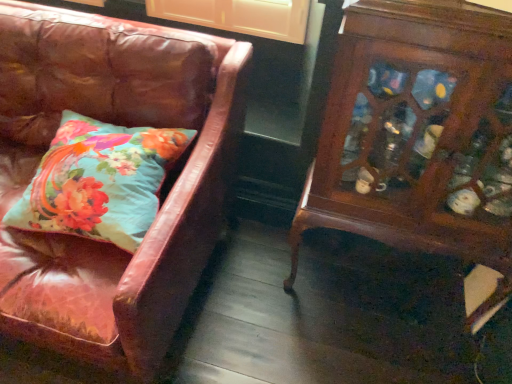
Question: From the image's perspective, does wooden cabinet at right appear lower than leather couch at left?

Choices:
 (A) yes
 (B) no

Answer: (A)

Question: Does wooden cabinet at right have a greater height compared to leather couch at left?

Choices:
 (A) no
 (B) yes

Answer: (B)

Question: Is wooden cabinet at right positioned beyond the bounds of leather couch at left?

Choices:
 (A) no
 (B) yes

Answer: (B)

Question: Is wooden cabinet at right smaller than leather couch at left?

Choices:
 (A) no
 (B) yes

Answer: (B)

Question: Would you say wooden cabinet at right contains leather couch at left?

Choices:
 (A) yes
 (B) no

Answer: (B)

Question: From the image's perspective, is wooden cabinet at right positioned above or below leather couch at left?

Choices:
 (A) below
 (B) above

Answer: (A)

Question: Looking at the image, does wooden cabinet at right seem bigger or smaller compared to leather couch at left?

Choices:
 (A) small
 (B) big

Answer: (A)

Question: Considering their positions, is wooden cabinet at right located in front of or behind leather couch at left?

Choices:
 (A) front
 (B) behind

Answer: (B)

Question: From a real-world perspective, relative to leather couch at left, is wooden cabinet at right vertically above or below?

Choices:
 (A) above
 (B) below

Answer: (A)

Question: Does point (60, 170) appear closer or farther from the camera than point (161, 122)?

Choices:
 (A) closer
 (B) farther

Answer: (A)

Question: Do you think teal floral pillow at left is within leather couch at left, or outside of it?

Choices:
 (A) outside
 (B) inside

Answer: (B)

Question: Considering the positions of teal floral pillow at left and leather couch at left in the image, is teal floral pillow at left bigger or smaller than leather couch at left?

Choices:
 (A) big
 (B) small

Answer: (B)

Question: In terms of height, does teal floral pillow at left look taller or shorter compared to leather couch at left?

Choices:
 (A) short
 (B) tall

Answer: (A)

Question: In terms of height, does teal floral pillow at left look taller or shorter compared to wooden cabinet at right?

Choices:
 (A) tall
 (B) short

Answer: (B)

Question: From the image's perspective, is teal floral pillow at left located above or below wooden cabinet at right?

Choices:
 (A) above
 (B) below

Answer: (A)